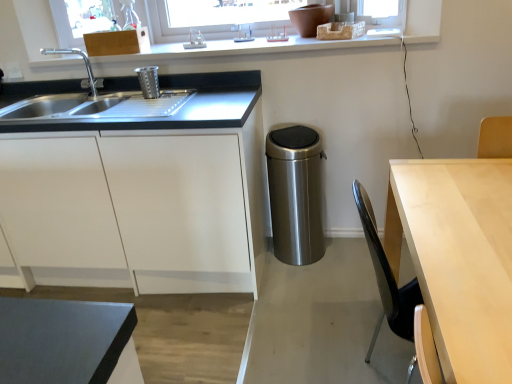
Where is `brushed metal faucet at left`? This screenshot has height=384, width=512. brushed metal faucet at left is located at coordinates (85, 65).

Measure the distance between stainless steel trash can at center, which is the first appliance in right-to-left order, and camera.

stainless steel trash can at center, which is the first appliance in right-to-left order, and camera are 6.66 feet apart from each other.

The width and height of the screenshot is (512, 384). Describe the element at coordinates (160, 117) in the screenshot. I see `satin steel sink at left` at that location.

Where is `satin steel sink at left`? Image resolution: width=512 pixels, height=384 pixels. satin steel sink at left is located at coordinates (160, 117).

Describe the element at coordinates (266, 46) in the screenshot. The height and width of the screenshot is (384, 512). I see `white plastic window frame at upper center` at that location.

Identify the location of wooden cutting board at upper left, acting as the 1th cabinetry starting from the top. The image size is (512, 384). (117, 42).

Is brushed metal faucet at left positioned behind white matte cabinet at left, the 1th cabinetry positioned from the bottom?

Yes.

Considering the positions of objects brushed metal faucet at left and white matte cabinet at left, the second cabinetry viewed from the top, in the image provided, who is more to the left, brushed metal faucet at left or white matte cabinet at left, the second cabinetry viewed from the top,?

white matte cabinet at left, the second cabinetry viewed from the top, is more to the left.

Is brushed metal faucet at left far from white matte cabinet at left, the second cabinetry viewed from the top?

That's not correct — brushed metal faucet at left is a little close to white matte cabinet at left, the second cabinetry viewed from the top.

Who is shorter, light wood table at right or brushed metal trash can at upper left, the 1th appliance in the left-to-right sequence?

brushed metal trash can at upper left, the 1th appliance in the left-to-right sequence, is shorter.

Considering the points (503, 365) and (151, 74), which point is behind, point (503, 365) or point (151, 74)?

The point (151, 74) is farther from the camera.

Which of these two, light wood table at right or brushed metal trash can at upper left, marked as the 1th appliance in a top-to-bottom arrangement, is smaller?

Answer: brushed metal trash can at upper left, marked as the 1th appliance in a top-to-bottom arrangement, is smaller.

Could you measure the distance between light wood table at right and brushed metal trash can at upper left, the 1th appliance in the left-to-right sequence?

light wood table at right is 4.86 feet away from brushed metal trash can at upper left, the 1th appliance in the left-to-right sequence.

Can you confirm if satin steel sink at left is bigger than stainless steel trash can at center, the 2th appliance when ordered from top to bottom?

Yes, satin steel sink at left is bigger than stainless steel trash can at center, the 2th appliance when ordered from top to bottom.

Which is behind, point (234, 109) or point (276, 224)?

The point (276, 224) is more distant.

Is satin steel sink at left in front of or behind stainless steel trash can at center, the second appliance viewed from the left, in the image?

Visually, satin steel sink at left is located in front of stainless steel trash can at center, the second appliance viewed from the left.

Locate an element on the screen. The width and height of the screenshot is (512, 384). appliance below the satin steel sink at left (from the image's perspective) is located at coordinates (295, 194).

From a real-world perspective, which is physically below, satin steel sink at left or light wood table at right?

light wood table at right is physically lower.

Which object is more forward, satin steel sink at left or light wood table at right?

light wood table at right is in front.

Considering the relative positions of stainless steel trash can at center, the 2th appliance when ordered from top to bottom, and satin steel sink at left in the image provided, is stainless steel trash can at center, the 2th appliance when ordered from top to bottom, to the right of satin steel sink at left from the viewer's perspective?

Indeed, stainless steel trash can at center, the 2th appliance when ordered from top to bottom, is positioned on the right side of satin steel sink at left.

Is stainless steel trash can at center, the second appliance viewed from the left, positioned with its back to satin steel sink at left?

No.

From the image's perspective, between stainless steel trash can at center, arranged as the first appliance when ordered from the bottom, and satin steel sink at left, who is located below?

stainless steel trash can at center, arranged as the first appliance when ordered from the bottom, from the image's perspective.

From a real-world perspective, which object rests below the other?

stainless steel trash can at center, the 2th appliance when ordered from top to bottom.

From the image's perspective, is white matte cabinet at left, the second cabinetry viewed from the top, on satin steel sink at left?

No.

Is white matte cabinet at left, the 1th cabinetry positioned from the bottom, bigger or smaller than satin steel sink at left?

white matte cabinet at left, the 1th cabinetry positioned from the bottom, is bigger than satin steel sink at left.

From a real-world perspective, is white matte cabinet at left, the 1th cabinetry positioned from the bottom, physically above satin steel sink at left?

No, from a real-world perspective, white matte cabinet at left, the 1th cabinetry positioned from the bottom, is not above satin steel sink at left.

Does point (90, 170) come closer to viewer compared to point (194, 119)?

That is False.

Which object is closer to the camera taking this photo, satin steel sink at left or white plastic window frame at upper center?

satin steel sink at left is in front.

From a real-world perspective, is satin steel sink at left positioned under white plastic window frame at upper center based on gravity?

Yes, from a real-world perspective, satin steel sink at left is beneath white plastic window frame at upper center.

Does satin steel sink at left have a greater width compared to white plastic window frame at upper center?

Incorrect, the width of satin steel sink at left does not surpass that of white plastic window frame at upper center.

Where is `cabinetry in front of the brushed metal faucet at left`? This screenshot has width=512, height=384. cabinetry in front of the brushed metal faucet at left is located at coordinates (140, 203).

Identify the location of table that appears on the right of brushed metal trash can at upper left, the 1th appliance in the left-to-right sequence. This screenshot has height=384, width=512. (458, 258).

Based on their spatial positions, is stainless steel trash can at center, arranged as the first appliance when ordered from the bottom, or white plastic window frame at upper center further from brushed metal trash can at upper left, the 1th appliance in the left-to-right sequence?

Based on the image, stainless steel trash can at center, arranged as the first appliance when ordered from the bottom, appears to be further to brushed metal trash can at upper left, the 1th appliance in the left-to-right sequence.

Which object lies nearer to the anchor point wooden cutting board at upper left, arranged as the 2th cabinetry when ordered from the bottom, white matte cabinet at left, the second cabinetry viewed from the top, or light wood table at right?

Among the two, white matte cabinet at left, the second cabinetry viewed from the top, is located nearer to wooden cutting board at upper left, arranged as the 2th cabinetry when ordered from the bottom.

When comparing their distances from satin steel sink at left, does white plastic window frame at upper center or stainless steel trash can at center, the 2th appliance when ordered from top to bottom, seem further?

stainless steel trash can at center, the 2th appliance when ordered from top to bottom.

When comparing their distances from brushed metal trash can at upper left, marked as the 1th appliance in a top-to-bottom arrangement, does wooden cutting board at upper left, acting as the 1th cabinetry starting from the top, or white plastic window frame at upper center seem closer?

wooden cutting board at upper left, acting as the 1th cabinetry starting from the top.

Considering their positions, is wooden cutting board at upper left, acting as the 1th cabinetry starting from the top, positioned further to satin steel sink at left than light wood table at right?

light wood table at right.

Looking at the image, which one is located further to white plastic window frame at upper center, stainless steel trash can at center, which is the first appliance in right-to-left order, or wooden cutting board at upper left, acting as the 1th cabinetry starting from the top?

Based on the image, stainless steel trash can at center, which is the first appliance in right-to-left order, appears to be further to white plastic window frame at upper center.

Based on their spatial positions, is brushed metal trash can at upper left, which is the second appliance in right-to-left order, or wooden cutting board at upper left, acting as the 1th cabinetry starting from the top, further from white plastic window frame at upper center?

brushed metal trash can at upper left, which is the second appliance in right-to-left order, is further to white plastic window frame at upper center.

From the image, which object appears to be nearer to light wood table at right, white matte cabinet at left, the second cabinetry viewed from the top, or satin steel sink at left?

The object closer to light wood table at right is satin steel sink at left.

This screenshot has width=512, height=384. What are the coordinates of `cabinetry between brushed metal faucet at left and light wood table at right` in the screenshot? It's located at (117, 42).

Where is `appliance between wooden cutting board at upper left, acting as the 1th cabinetry starting from the top, and white matte cabinet at left, the 1th cabinetry positioned from the bottom, vertically`? The image size is (512, 384). appliance between wooden cutting board at upper left, acting as the 1th cabinetry starting from the top, and white matte cabinet at left, the 1th cabinetry positioned from the bottom, vertically is located at coordinates (148, 81).

You are a GUI agent. You are given a task and a screenshot of the screen. Output one action in this format:
    pyautogui.click(x=<x>, y=<y>)
    Task: Click on the tap between satin steel sink at left and wooden cutting board at upper left, acting as the 1th cabinetry starting from the top, along the z-axis
    
    Given the screenshot: What is the action you would take?
    pyautogui.click(x=85, y=65)

In order to click on countertop between brushed metal faucet at left and white matte cabinet at left, the 1th cabinetry positioned from the bottom, in the vertical direction in this screenshot , I will do `click(160, 117)`.